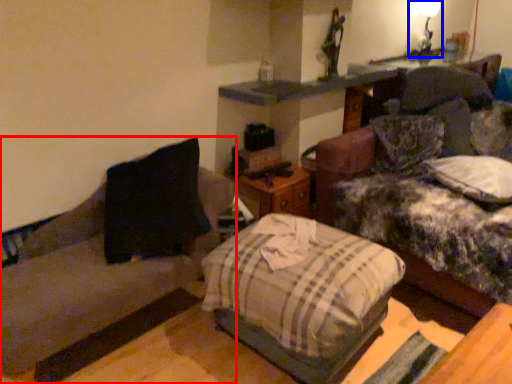
Question: Among these objects, which one is nearest to the camera, studio couch (highlighted by a red box) or light fixture (highlighted by a blue box)?

Choices:
 (A) studio couch
 (B) light fixture

Answer: (A)